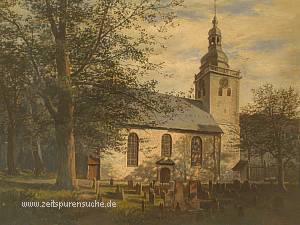
Find the location of a particular element. This screenshot has height=225, width=300. right window is located at coordinates (198, 155).